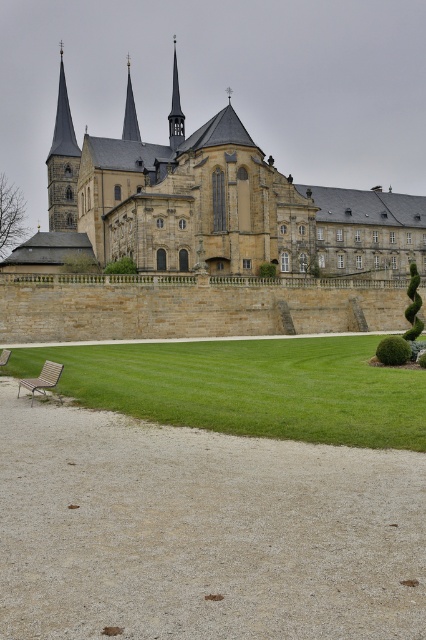
You are an architect visiting this historic site and want to take a photo of the smooth gold spire at upper left and the wooden park bench at lower left. Based on their sizes, which object should you focus on first to ensure both are clearly visible in the frame?

The smooth gold spire at upper left is larger than the wooden park bench at lower left, so you should focus on the smooth gold spire at upper left first to ensure both are clearly visible in the frame.

You are a visitor standing at the entrance of the historic building and want to sit down. You see a wooden slats bench at lower left and a wooden park bench at lower left. Which bench is closer to you?

The wooden slats bench at lower left is closer to you because it is in front of the wooden park bench at lower left.

You are standing at the wooden slats bench at lower left and want to walk to the central spire of the building. The path is straight and unobstructed. If your walking speed is 1.5 meters per second, how long will it take you to reach the base of the central spire?

The distance between the wooden slats bench at lower left and the camera is 32.32 meters. Assuming the camera is positioned at the base of the central spire, it would take approximately 21.55 seconds to walk the distance at 1.5 mps.